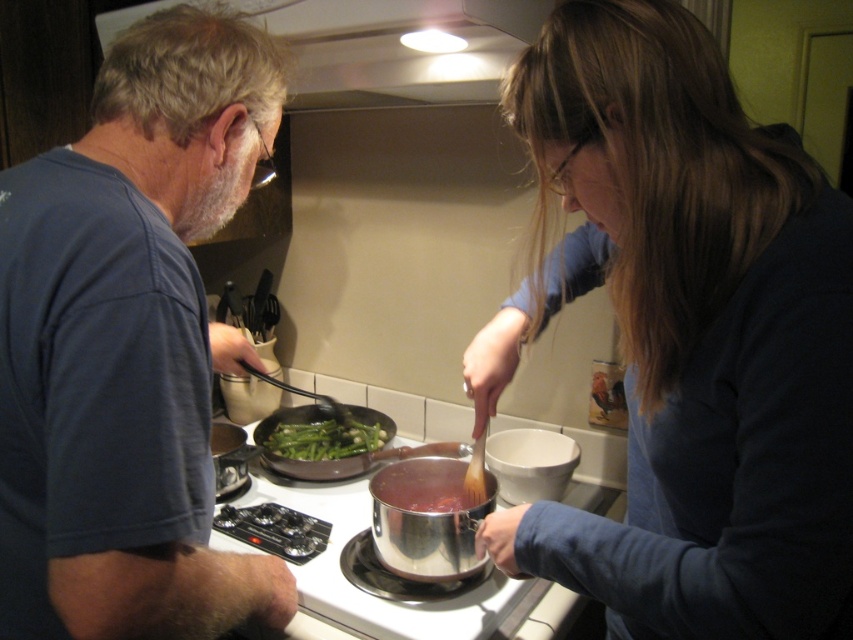
Question: Does shiny metallic pot at center appear on the right side of green matte asparagus at center?

Choices:
 (A) yes
 (B) no

Answer: (A)

Question: Can you confirm if blue cotton shirt at left is positioned below silver metallic pot at center?

Choices:
 (A) yes
 (B) no

Answer: (B)

Question: Among these points, which one is nearest to the camera?

Choices:
 (A) (82, 385)
 (B) (364, 36)
 (C) (310, 452)
 (D) (466, 506)

Answer: (A)

Question: Which of the following is the farthest from the observer?

Choices:
 (A) blue cotton shirt at left
 (B) white glossy exhaust hood at upper center
 (C) silver metallic pot at center
 (D) matte blue shirt at center

Answer: (C)

Question: In this image, where is silver metallic pot at center located relative to shiny metallic pot at center?

Choices:
 (A) left
 (B) right

Answer: (A)

Question: Which object is closer to the camera taking this photo?

Choices:
 (A) matte blue shirt at center
 (B) silver metallic pot at center

Answer: (A)